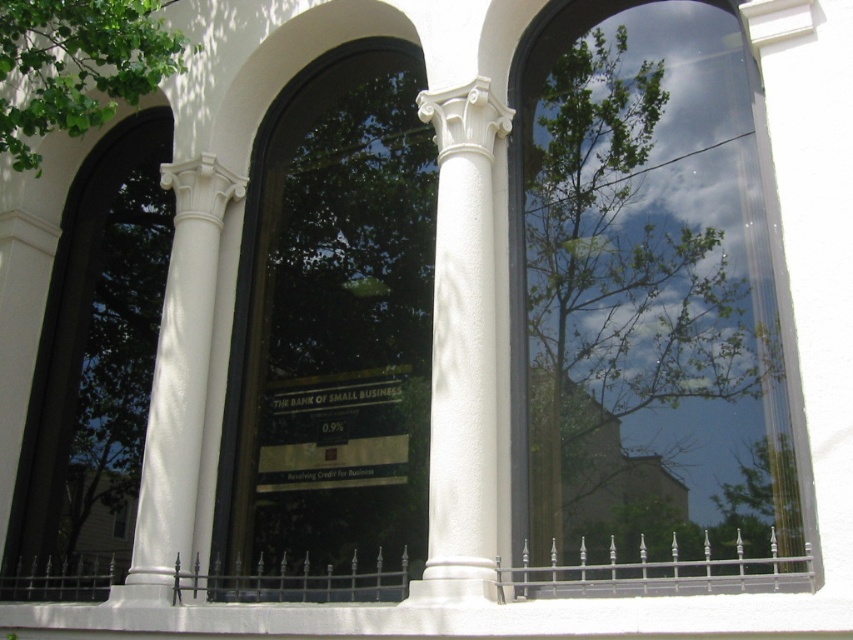
Is green leafy tree at upper right taller than white smooth column at center?

Yes.

Between green leafy tree at upper right and white smooth column at center, which one appears on the left side from the viewer's perspective?

From the viewer's perspective, white smooth column at center appears more on the left side.

Identify the location of green leafy tree at upper right. The image size is (853, 640). (651, 294).

You are a GUI agent. You are given a task and a screenshot of the screen. Output one action in this format:
    pyautogui.click(x=<x>, y=<y>)
    Task: Click on the green leafy tree at upper right
    Image resolution: width=853 pixels, height=640 pixels.
    Given the screenshot: What is the action you would take?
    pyautogui.click(x=651, y=294)

Is point (535, 291) closer to viewer compared to point (190, 417)?

Yes, it is.

Is green leafy tree at upper right below white glossy column at center?

Actually, green leafy tree at upper right is above white glossy column at center.

Where is `green leafy tree at upper right`? green leafy tree at upper right is located at coordinates (651, 294).

Who is lower down, white glossy column at center or green leafy tree at upper left?

white glossy column at center is below.

Is white glossy column at center behind green leafy tree at upper left?

Yes, it is.

The height and width of the screenshot is (640, 853). Describe the element at coordinates (178, 380) in the screenshot. I see `white glossy column at center` at that location.

Locate an element on the screen. This screenshot has height=640, width=853. white glossy column at center is located at coordinates (178, 380).